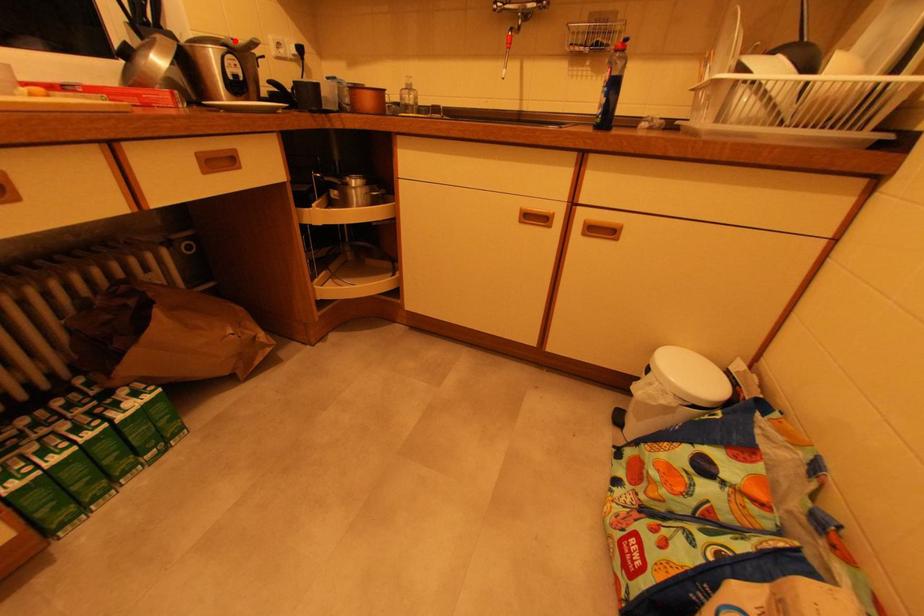
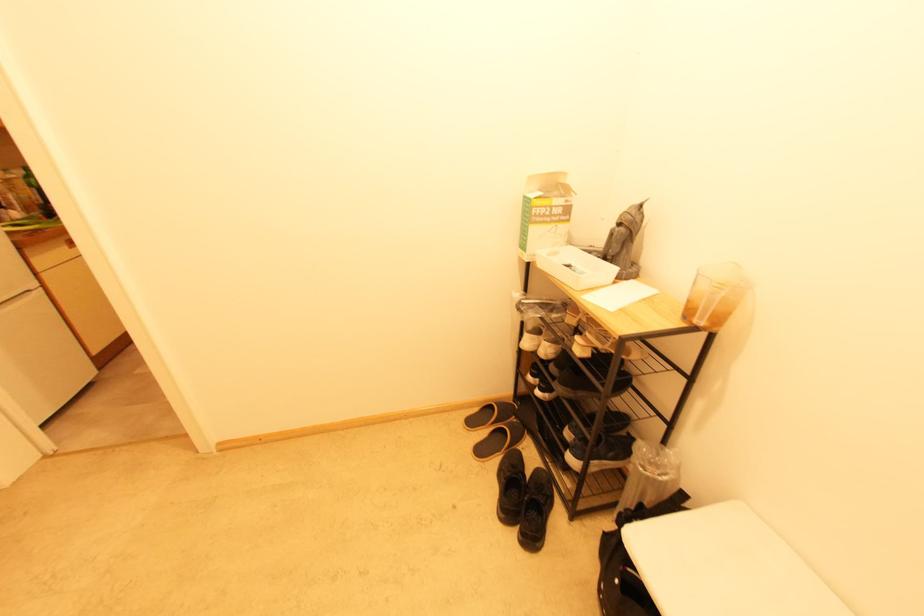
Question: I am providing you with two images of the same scene from different viewpoints. A red point is marked on the first image. Is the red point's position out of view in image 2?

Choices:
 (A) Yes
 (B) No

Answer: (A)